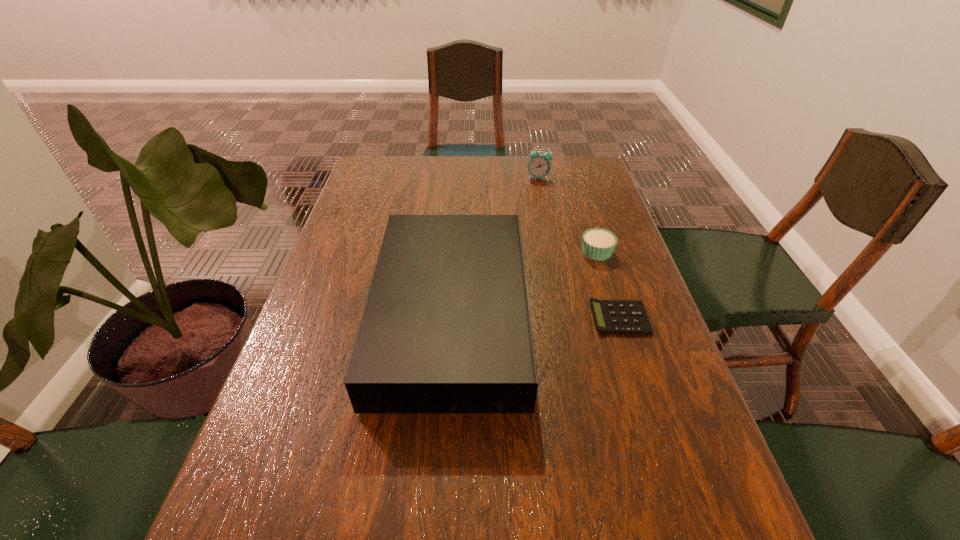
You are a GUI agent. You are given a task and a screenshot of the screen. Output one action in this format:
    pyautogui.click(x=<x>, y=<y>)
    Task: Click on the vacant space that is in between the calculator and the alarm clock
    This screenshot has height=540, width=960.
    Given the screenshot: What is the action you would take?
    pyautogui.click(x=579, y=248)

This screenshot has height=540, width=960. I want to click on unoccupied area between the third tallest object and the alarm clock, so click(567, 215).

This screenshot has height=540, width=960. I want to click on empty space that is in between the cupcake and the farthest object, so click(567, 215).

You are a GUI agent. You are given a task and a screenshot of the screen. Output one action in this format:
    pyautogui.click(x=<x>, y=<y>)
    Task: Click on the free space between the calculator and the CD player
    This screenshot has width=960, height=540.
    Given the screenshot: What is the action you would take?
    pyautogui.click(x=536, y=317)

What are the coordinates of `object identified as the third closest to the leftmost object` in the screenshot? It's located at (539, 166).

The width and height of the screenshot is (960, 540). Identify the location of object that ranks as the second closest to the third tallest object. (446, 328).

The height and width of the screenshot is (540, 960). Find the location of `vacant space that satisfies the following two spatial constraints: 1. on the face of the calculator; 2. on the left side of the farthest object`. vacant space that satisfies the following two spatial constraints: 1. on the face of the calculator; 2. on the left side of the farthest object is located at coordinates (566, 318).

Locate an element on the screen. The height and width of the screenshot is (540, 960). free space that satisfies the following two spatial constraints: 1. on the face of the third object from right to left; 2. on the right side of the shortest object is located at coordinates (566, 318).

The width and height of the screenshot is (960, 540). I want to click on vacant space that satisfies the following two spatial constraints: 1. on the face of the second object from left to right; 2. at the front of the leftmost object for disc insertion, so click(x=565, y=315).

Locate an element on the screen. This screenshot has width=960, height=540. vacant region that satisfies the following two spatial constraints: 1. on the front side of the cupcake; 2. on the right side of the calculator is located at coordinates click(617, 318).